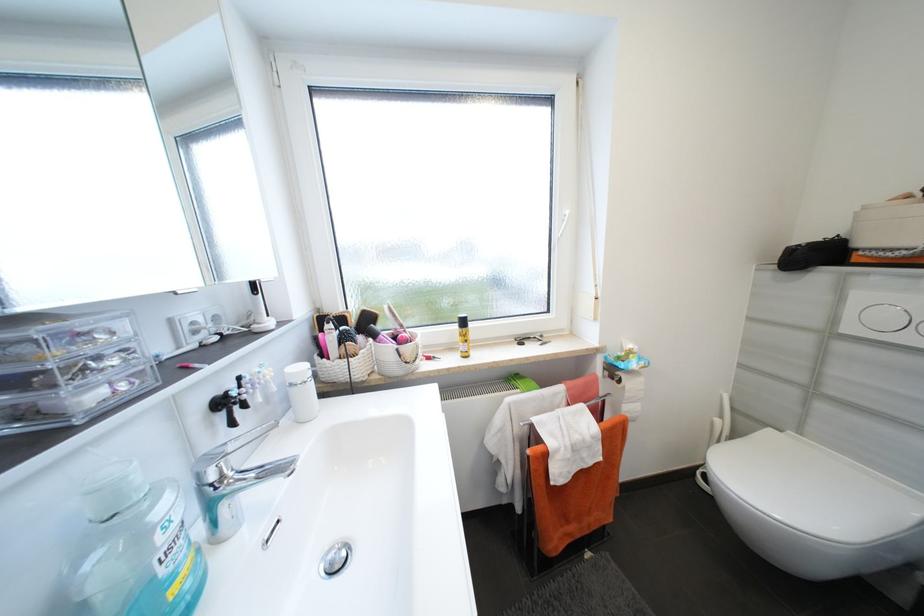
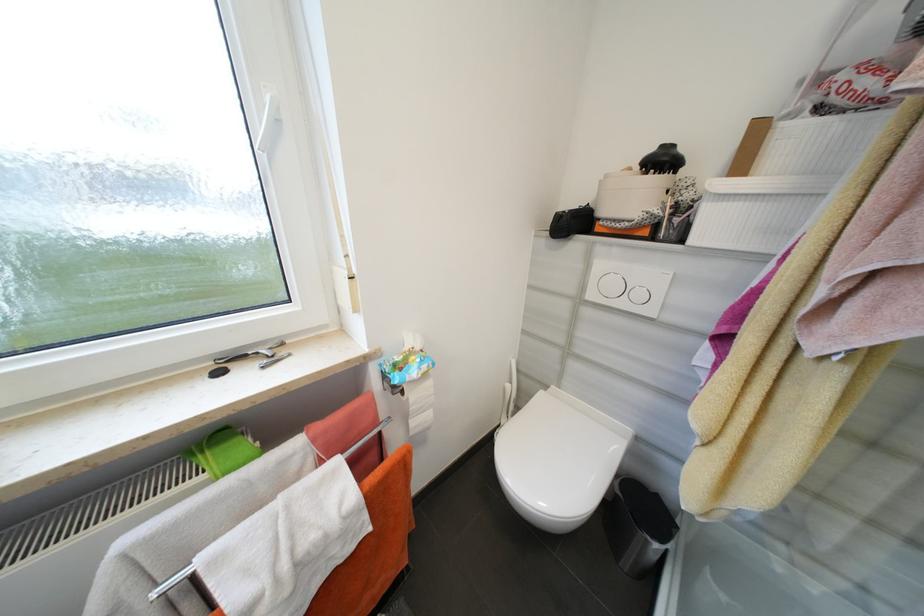
In the second image, find the point that corresponds to pixel 796 252 in the first image.

(565, 217)